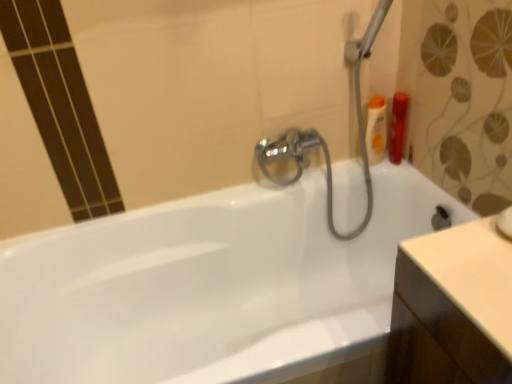
Question: In terms of width, does white glossy bathtub at center look wider or thinner when compared to translucent orange bottle at upper right, which ranks as the second toiletry in right-to-left order?

Choices:
 (A) thin
 (B) wide

Answer: (B)

Question: From a real-world perspective, is white glossy bathtub at center above or below translucent orange bottle at upper right, which ranks as the second toiletry in right-to-left order?

Choices:
 (A) above
 (B) below

Answer: (B)

Question: Based on their relative distances, which object is farther from the matte orange bottle at upper right, arranged as the first toiletry when viewed from the right?

Choices:
 (A) translucent orange bottle at upper right, which ranks as the second toiletry in right-to-left order
 (B) white glossy bathtub at center

Answer: (B)

Question: Considering the real-world distances, which object is closest to the translucent orange bottle at upper right, the 1th toiletry in the left-to-right sequence?

Choices:
 (A) matte orange bottle at upper right, which ranks as the 2th toiletry in left-to-right order
 (B) white glossy bathtub at center

Answer: (A)